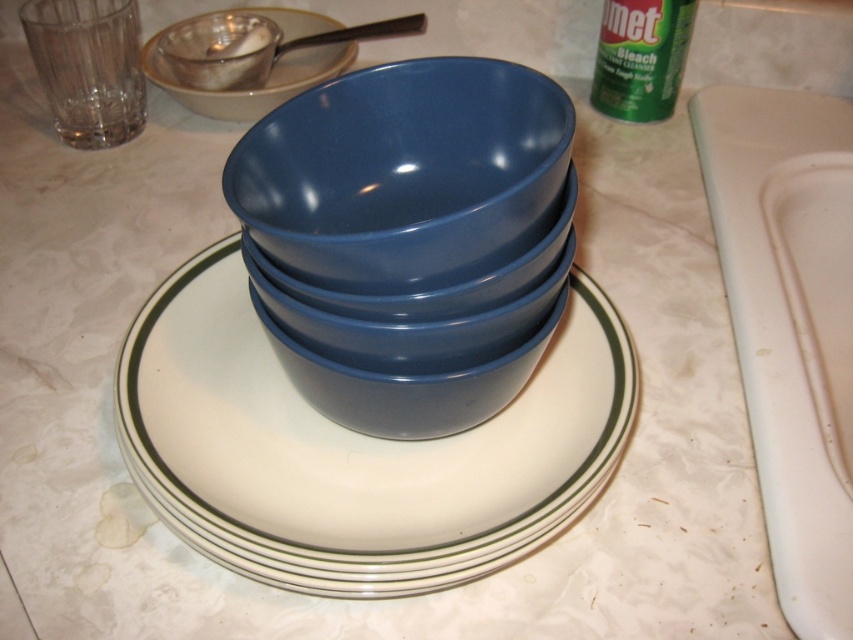
Question: Is white glossy platter at center closer to camera compared to matte ceramic saucer at upper left?

Choices:
 (A) yes
 (B) no

Answer: (A)

Question: Which of the following is the farthest from the observer?

Choices:
 (A) (473, 168)
 (B) (285, 547)

Answer: (A)

Question: Does white glossy platter at center have a smaller size compared to matte ceramic saucer at upper left?

Choices:
 (A) no
 (B) yes

Answer: (A)

Question: Considering the relative positions of white glossy platter at center and matte blue bowl at center in the image provided, where is white glossy platter at center located with respect to matte blue bowl at center?

Choices:
 (A) below
 (B) above

Answer: (A)

Question: Among these objects, which one is farthest from the camera?

Choices:
 (A) matte ceramic saucer at upper left
 (B) white glossy platter at center

Answer: (A)

Question: Among these objects, which one is nearest to the camera?

Choices:
 (A) matte blue bowl at center
 (B) matte ceramic saucer at upper left
 (C) white glossy platter at center

Answer: (A)